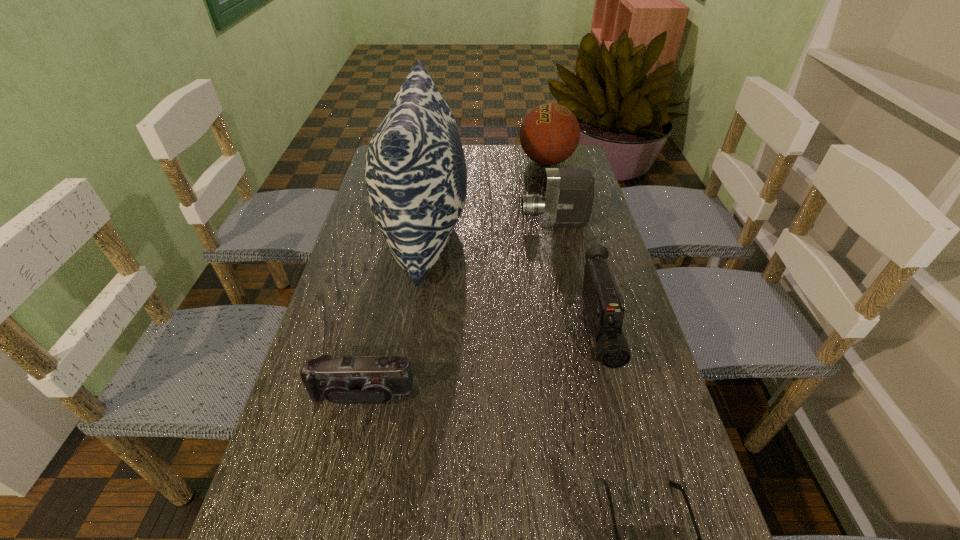
Image resolution: width=960 pixels, height=540 pixels. In order to click on vacant region located 0.210m on the front-facing side of the second shortest object in this screenshot , I will do `click(332, 524)`.

The image size is (960, 540). What are the coordinates of `object that is at the far edge` in the screenshot? It's located at (550, 133).

In order to click on cushion situated at the left edge in this screenshot , I will do `click(415, 171)`.

You are a GUI agent. You are given a task and a screenshot of the screen. Output one action in this format:
    pyautogui.click(x=<x>, y=<y>)
    Task: Click on the camcorder positioned at the left edge
    The width and height of the screenshot is (960, 540).
    Given the screenshot: What is the action you would take?
    (367, 379)

Where is `basketball present at the right edge`? basketball present at the right edge is located at coordinates (550, 133).

Find the location of a particular element. This screenshot has width=960, height=540. object at the far right corner is located at coordinates (550, 133).

In the image, there is a desktop. Where is `vacant space at the far edge`? vacant space at the far edge is located at coordinates (485, 146).

This screenshot has width=960, height=540. In the image, there is a desktop. Identify the location of free region at the left edge. (395, 305).

The height and width of the screenshot is (540, 960). In order to click on vacant space at the right edge of the desktop in this screenshot , I will do `click(583, 276)`.

At what (x,y) coordinates should I click in order to perform the action: click on vacant region at the far right corner of the desktop. Please return your answer as a coordinate pair (x, y). This screenshot has height=540, width=960. Looking at the image, I should click on (577, 151).